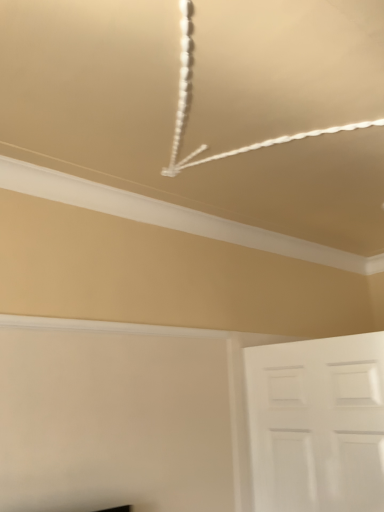
What do you see at coordinates (317, 424) in the screenshot? I see `white matte door at lower right` at bounding box center [317, 424].

The image size is (384, 512). I want to click on white matte door at lower right, so click(317, 424).

In order to face white matte door at lower right, should I rotate leftwards or rightwards?

Turn right approximately 16.573 degrees to face it.

Where is `white matte door at lower right`? The height and width of the screenshot is (512, 384). white matte door at lower right is located at coordinates [317, 424].